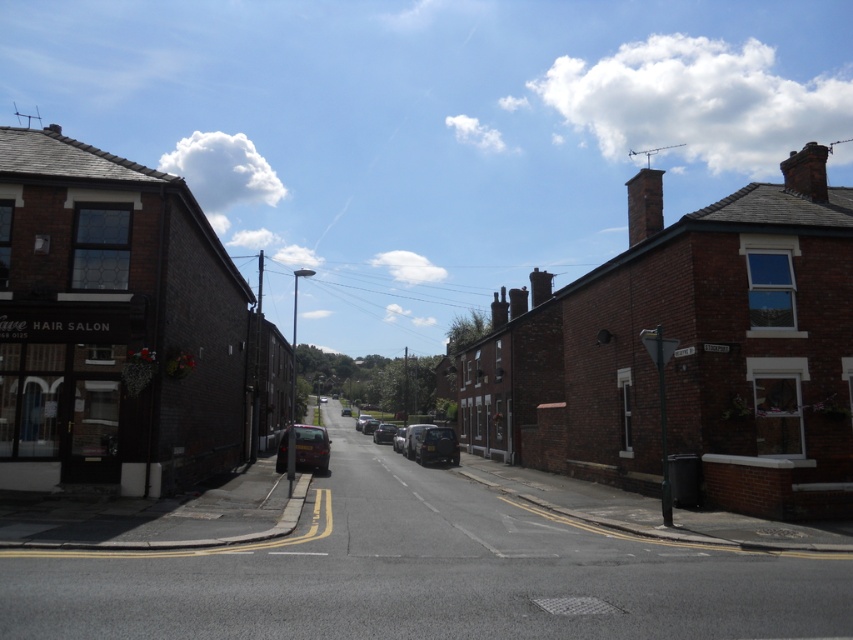
Who is positioned more to the left, shiny silver car at center or metallic gray car at center?

From the viewer's perspective, shiny silver car at center appears more on the left side.

Between point (392, 429) and point (403, 426), which one is positioned behind?

The point (403, 426) is behind.

Between point (378, 435) and point (398, 429), which one is positioned behind?

The point (378, 435) is behind.

Locate an element on the screen. The image size is (853, 640). shiny silver car at center is located at coordinates (384, 433).

Can you confirm if smooth asphalt road at center is positioned to the left of shiny black car at center?

No, smooth asphalt road at center is not to the left of shiny black car at center.

From the picture: Does smooth asphalt road at center have a greater height compared to shiny black car at center?

Incorrect, smooth asphalt road at center's height is not larger of shiny black car at center's.

Who is more distant from viewer, (x=506, y=609) or (x=454, y=452)?

Point (x=454, y=452)

You are a GUI agent. You are given a task and a screenshot of the screen. Output one action in this format:
    pyautogui.click(x=<x>, y=<y>)
    Task: Click on the smooth asphalt road at center
    
    Given the screenshot: What is the action you would take?
    pyautogui.click(x=424, y=573)

Who is positioned more to the right, shiny black car at center or metallic gray car at center?

shiny black car at center

Is shiny black car at center below metallic gray car at center?

→ No.

Which is behind, point (410, 436) or point (396, 449)?

The point (396, 449) is more distant.

At what (x,y) coordinates should I click in order to perform the action: click on shiny black car at center. Please return your answer as a coordinate pair (x, y). Image resolution: width=853 pixels, height=640 pixels. Looking at the image, I should click on [426, 442].